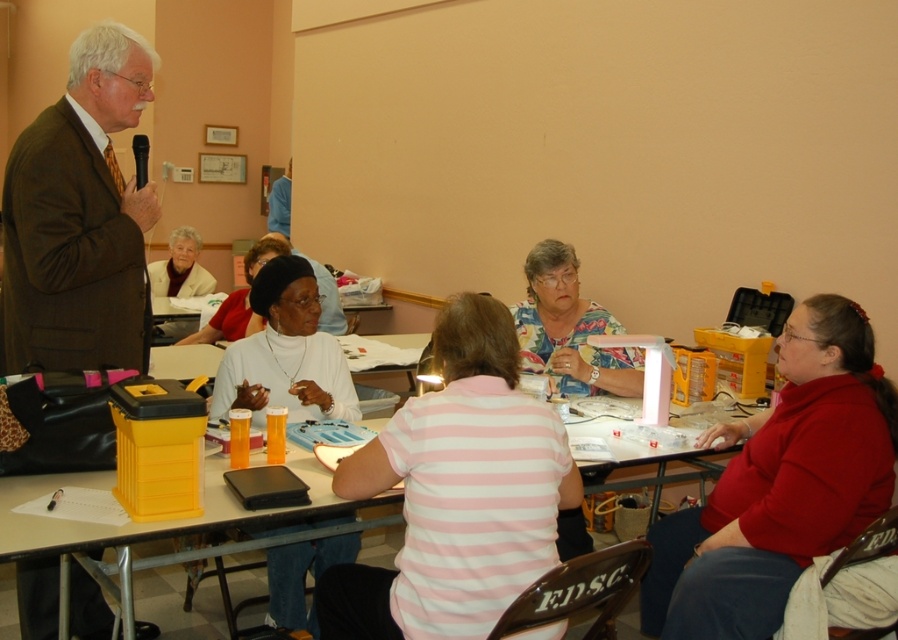
Does white matte shirt at center appear under matte black hat at center?

Correct, white matte shirt at center is located below matte black hat at center.

This screenshot has width=898, height=640. Identify the location of white matte shirt at center. (286, 353).

Is point (307, 326) in front of point (260, 243)?

Yes, point (307, 326) is closer to viewer.

Where is `white matte shirt at center`? Image resolution: width=898 pixels, height=640 pixels. white matte shirt at center is located at coordinates (286, 353).

Can you confirm if brown textured suit at upper left is taller than white matte shirt at center?

Yes.

Is brown textured suit at upper left wider than white matte shirt at center?

In fact, brown textured suit at upper left might be narrower than white matte shirt at center.

What do you see at coordinates (78, 216) in the screenshot? I see `brown textured suit at upper left` at bounding box center [78, 216].

Locate an element on the screen. The height and width of the screenshot is (640, 898). brown textured suit at upper left is located at coordinates pos(78,216).

Is pink striped shirt at center above red matte sweater at lower right?

Yes.

Does pink striped shirt at center have a larger size compared to red matte sweater at lower right?

Actually, pink striped shirt at center might be smaller than red matte sweater at lower right.

Who is more distant from viewer, (403, 566) or (665, 579)?

The point (665, 579) is behind.

Where is `pink striped shirt at center`? This screenshot has width=898, height=640. pink striped shirt at center is located at coordinates (456, 492).